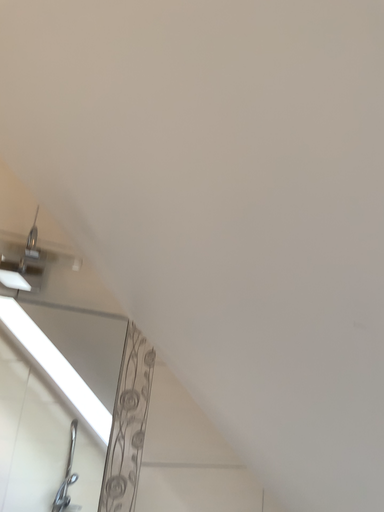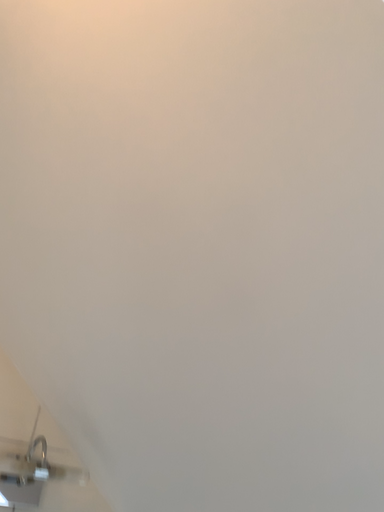
Question: How did the camera likely rotate when shooting the video?

Choices:
 (A) rotated upward
 (B) rotated downward

Answer: (A)